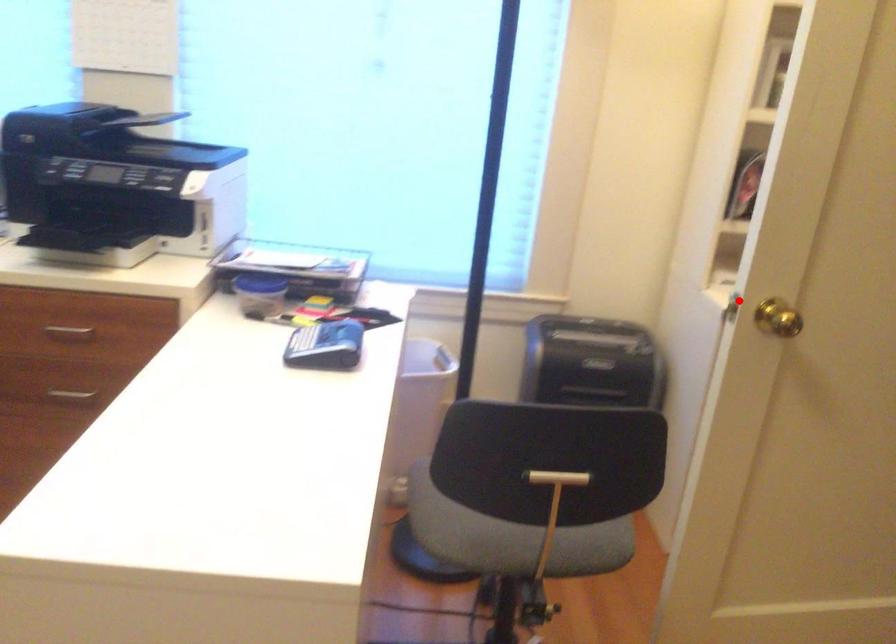
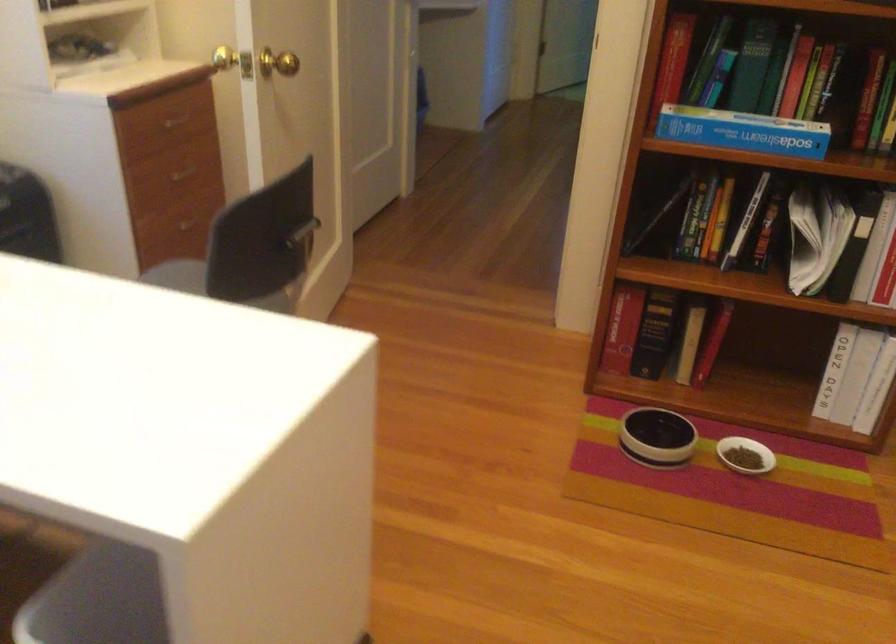
Question: I am providing you with two images of the same scene from different viewpoints. In image1, a red point is highlighted. Considering the same 3D point in image2, which of the following is correct?

Choices:
 (A) It is closer
 (B) It is farther

Answer: (B)